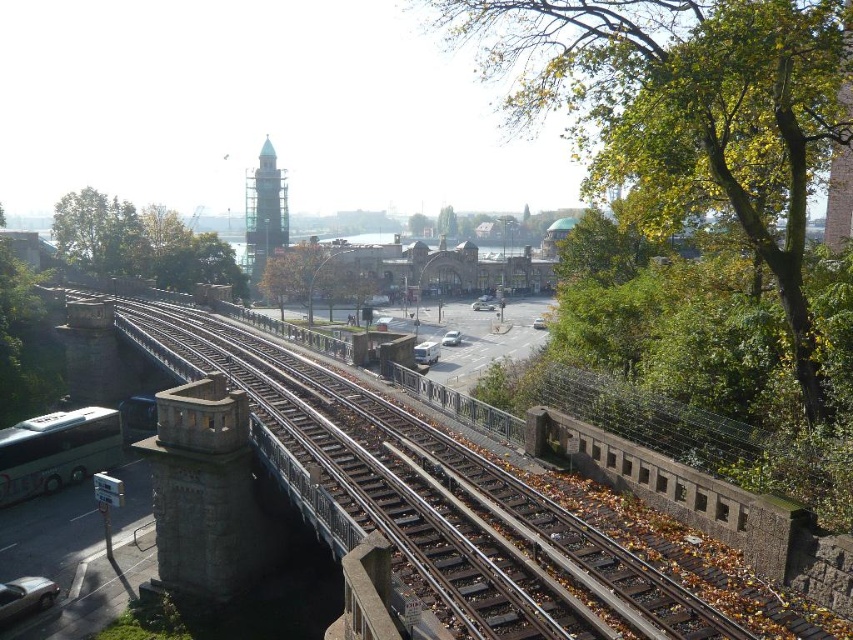
From the picture: Does green leafy tree at upper left have a smaller size compared to matte silver van at center?

No, green leafy tree at upper left is not smaller than matte silver van at center.

Is green leafy tree at upper left below matte silver van at center?

Incorrect, green leafy tree at upper left is not positioned below matte silver van at center.

Who is more distant from viewer, (163, 257) or (460, 339)?

The point (460, 339) is more distant.

Where is `green leafy tree at upper left`? This screenshot has height=640, width=853. green leafy tree at upper left is located at coordinates (140, 243).

This screenshot has width=853, height=640. Find the location of `green leafy tree at upper left`. green leafy tree at upper left is located at coordinates (140, 243).

Can you confirm if green leafy tree at upper left is taller than white glossy bus at lower left?

Indeed, green leafy tree at upper left has a greater height compared to white glossy bus at lower left.

Describe the element at coordinates (140, 243) in the screenshot. I see `green leafy tree at upper left` at that location.

Image resolution: width=853 pixels, height=640 pixels. Find the location of `green leafy tree at upper left`. green leafy tree at upper left is located at coordinates (140, 243).

Based on the photo, does green leafy tree at upper left appear on the left side of white matte van at center?

Indeed, green leafy tree at upper left is positioned on the left side of white matte van at center.

You are a GUI agent. You are given a task and a screenshot of the screen. Output one action in this format:
    pyautogui.click(x=<x>, y=<y>)
    Task: Click on the green leafy tree at upper left
    The width and height of the screenshot is (853, 640).
    Given the screenshot: What is the action you would take?
    pyautogui.click(x=140, y=243)

The width and height of the screenshot is (853, 640). In order to click on green leafy tree at upper left in this screenshot , I will do (x=140, y=243).